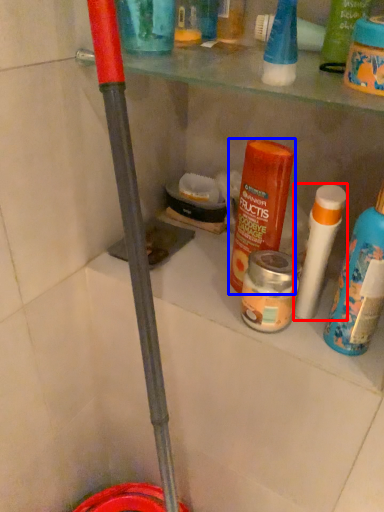
Question: Among these objects, which one is nearest to the camera, cleaning product (highlighted by a red box) or product (highlighted by a blue box)?

Choices:
 (A) cleaning product
 (B) product

Answer: (A)